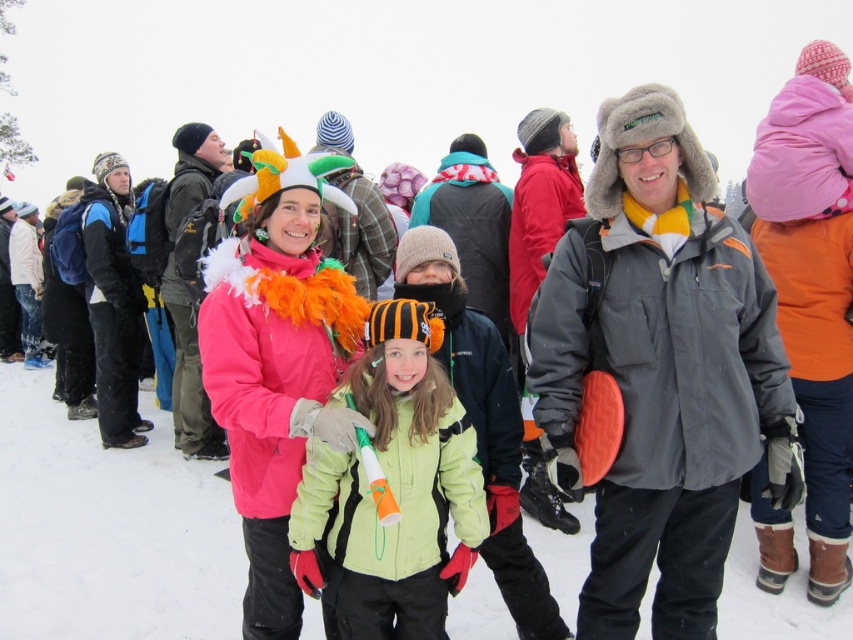
Can you confirm if matte pink jacket at center is positioned above light green fleece jacket at center?

Indeed, matte pink jacket at center is positioned over light green fleece jacket at center.

Locate an element on the screen. The image size is (853, 640). matte pink jacket at center is located at coordinates (277, 358).

Where is `matte pink jacket at center`? The image size is (853, 640). matte pink jacket at center is located at coordinates (277, 358).

Who is taller, gray woolen hat at center or light green fleece jacket at center?

gray woolen hat at center is taller.

Does point (686, 474) come closer to viewer compared to point (361, 369)?

Yes, it is.

You are a GUI agent. You are given a task and a screenshot of the screen. Output one action in this format:
    pyautogui.click(x=<x>, y=<y>)
    Task: Click on the gray woolen hat at center
    Image resolution: width=853 pixels, height=640 pixels.
    Given the screenshot: What is the action you would take?
    pyautogui.click(x=659, y=372)

Is point (573, 308) behind point (277, 502)?

No, (573, 308) is in front of (277, 502).

At what (x,y) coordinates should I click in order to perform the action: click on gray woolen hat at center. Please return your answer as a coordinate pair (x, y). Looking at the image, I should click on (659, 372).

Which is in front, point (634, 531) or point (218, 376)?

Point (218, 376)

Locate an element on the screen. The height and width of the screenshot is (640, 853). gray woolen hat at center is located at coordinates (659, 372).